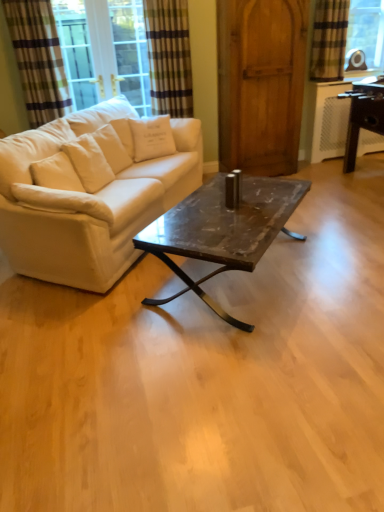
Question: From a real-world perspective, is green striped curtain at upper left, which appears as the 2th curtain when viewed from the right, over white cotton pillow at upper left, which is the second pillow in left-to-right order?

Choices:
 (A) yes
 (B) no

Answer: (A)

Question: From a real-world perspective, is green striped curtain at upper left, which appears as the 2th curtain when viewed from the right, physically below white cotton pillow at upper left, positioned as the 1th pillow in right-to-left order?

Choices:
 (A) yes
 (B) no

Answer: (B)

Question: Is green striped curtain at upper left, the second curtain from the left, next to white cotton pillow at upper left, which is counted as the first pillow, starting from the top, and touching it?

Choices:
 (A) yes
 (B) no

Answer: (B)

Question: Is white cotton pillow at upper left, positioned as the second pillow in bottom-to-top order, located within green striped curtain at upper left, which appears as the 2th curtain when viewed from the right?

Choices:
 (A) yes
 (B) no

Answer: (B)

Question: From the image's perspective, is green striped curtain at upper left, the second curtain from the left, beneath white cotton pillow at upper left, positioned as the 1th pillow in right-to-left order?

Choices:
 (A) yes
 (B) no

Answer: (B)

Question: Could you tell me if green striped curtain at upper left, which appears as the 2th curtain when viewed from the right, is turned towards white cotton pillow at upper left, placed as the 1th pillow when sorted from back to front?

Choices:
 (A) yes
 (B) no

Answer: (A)

Question: Is green striped curtain at upper left, the second curtain from the left, to the right of striped fabric curtain at upper left, which appears as the 3th curtain when viewed from the right, from the viewer's perspective?

Choices:
 (A) no
 (B) yes

Answer: (B)

Question: Is green striped curtain at upper left, which appears as the 2th curtain when viewed from the right, not inside striped fabric curtain at upper left, which appears as the first curtain when viewed from the left?

Choices:
 (A) no
 (B) yes

Answer: (B)

Question: Considering the relative sizes of green striped curtain at upper left, the second curtain from the left, and striped fabric curtain at upper left, which appears as the first curtain when viewed from the left, in the image provided, is green striped curtain at upper left, the second curtain from the left, smaller than striped fabric curtain at upper left, which appears as the first curtain when viewed from the left,?

Choices:
 (A) yes
 (B) no

Answer: (B)

Question: Does green striped curtain at upper left, which appears as the 2th curtain when viewed from the right, appear on the left side of striped fabric curtain at upper left, which appears as the 3th curtain when viewed from the right?

Choices:
 (A) no
 (B) yes

Answer: (A)

Question: From the image's perspective, would you say green striped curtain at upper left, the second curtain from the left, is positioned over striped fabric curtain at upper left, which appears as the 3th curtain when viewed from the right?

Choices:
 (A) no
 (B) yes

Answer: (A)

Question: Is green striped curtain at upper left, which appears as the 2th curtain when viewed from the right, further to camera compared to striped fabric curtain at upper left, which appears as the 3th curtain when viewed from the right?

Choices:
 (A) yes
 (B) no

Answer: (A)

Question: Does striped fabric curtain at upper left, which appears as the first curtain when viewed from the left, appear on the left side of wooden barn door at center?

Choices:
 (A) no
 (B) yes

Answer: (B)